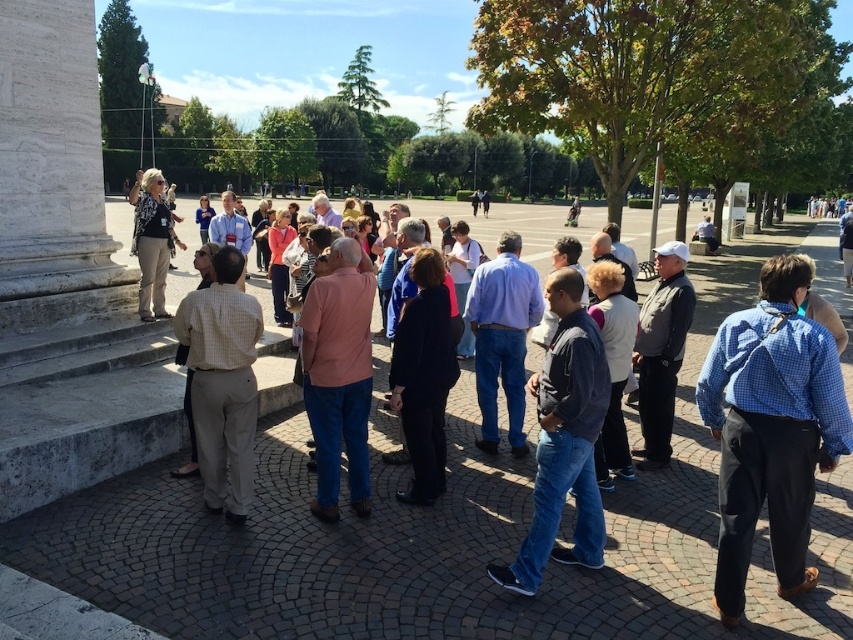
Is blue checkered shirt at center to the right of light beige scarf at upper left from the viewer's perspective?

Correct, you'll find blue checkered shirt at center to the right of light beige scarf at upper left.

Between blue checkered shirt at center and light beige scarf at upper left, which one is positioned higher?

light beige scarf at upper left

Identify the location of blue checkered shirt at center. (770, 429).

Image resolution: width=853 pixels, height=640 pixels. In order to click on blue checkered shirt at center in this screenshot , I will do `click(770, 429)`.

Can you confirm if light beige scarf at upper left is bigger than matte pink sweater at center?

Indeed, light beige scarf at upper left has a larger size compared to matte pink sweater at center.

Who is more distant from viewer, (154, 177) or (270, 248)?

Positioned behind is point (270, 248).

The image size is (853, 640). Find the location of `light beige scarf at upper left`. light beige scarf at upper left is located at coordinates click(x=152, y=241).

Is checkered shirt at lower left below dark brown leather jacket at center?

Actually, checkered shirt at lower left is above dark brown leather jacket at center.

Describe the element at coordinates (222, 381) in the screenshot. I see `checkered shirt at lower left` at that location.

The width and height of the screenshot is (853, 640). I want to click on checkered shirt at lower left, so click(222, 381).